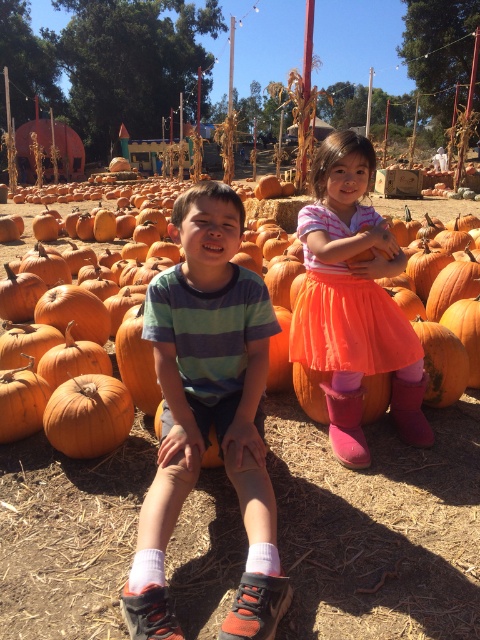
This screenshot has height=640, width=480. In order to click on pink tulle skirt at center in this screenshot , I will do `click(354, 301)`.

Identify the location of pink tulle skirt at center. This screenshot has width=480, height=640. (354, 301).

Locate an element on the screen. This screenshot has width=480, height=640. pink tulle skirt at center is located at coordinates (354, 301).

Does striped cotton shirt at center have a lesser height compared to pink tulle skirt at center?

Correct, striped cotton shirt at center is not as tall as pink tulle skirt at center.

Is striped cotton shirt at center wider than pink tulle skirt at center?

In fact, striped cotton shirt at center might be narrower than pink tulle skirt at center.

This screenshot has height=640, width=480. In order to click on striped cotton shirt at center in this screenshot , I will do `click(208, 412)`.

The width and height of the screenshot is (480, 640). Find the location of `striped cotton shirt at center`. striped cotton shirt at center is located at coordinates (208, 412).

Is the position of striped cotton shirt at center more distant than that of orange matte pumpkin at center?

No, striped cotton shirt at center is in front of orange matte pumpkin at center.

This screenshot has height=640, width=480. What do you see at coordinates (208, 412) in the screenshot?
I see `striped cotton shirt at center` at bounding box center [208, 412].

Does point (261, 321) come in front of point (268, 378)?

Yes, it is.

Identify the location of striped cotton shirt at center. The height and width of the screenshot is (640, 480). (208, 412).